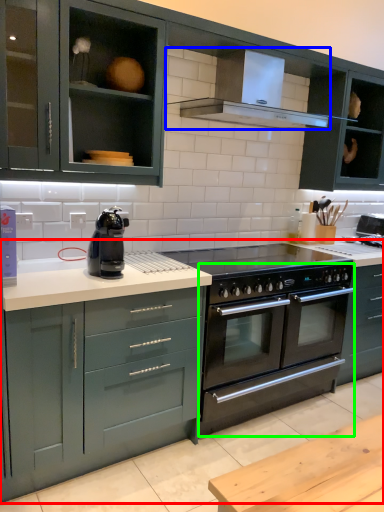
Question: Which object is positioned farthest from countertop (highlighted by a red box)? Select from kitchen appliance (highlighted by a blue box) and oven (highlighted by a green box).

Choices:
 (A) kitchen appliance
 (B) oven

Answer: (A)